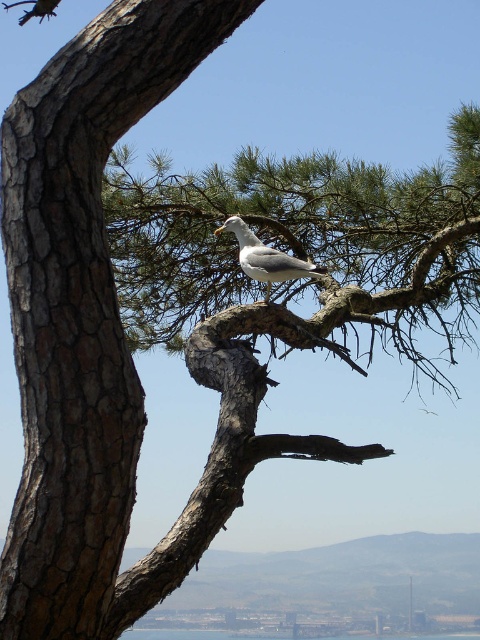
Between white matte bird at upper center and transparent blue water at center, which one is positioned higher?

white matte bird at upper center

Does white matte bird at upper center have a lesser width compared to transparent blue water at center?

No.

This screenshot has width=480, height=640. Identify the location of white matte bird at upper center. (266, 257).

Locate an element on the screen. This screenshot has height=640, width=480. white matte bird at upper center is located at coordinates (266, 257).